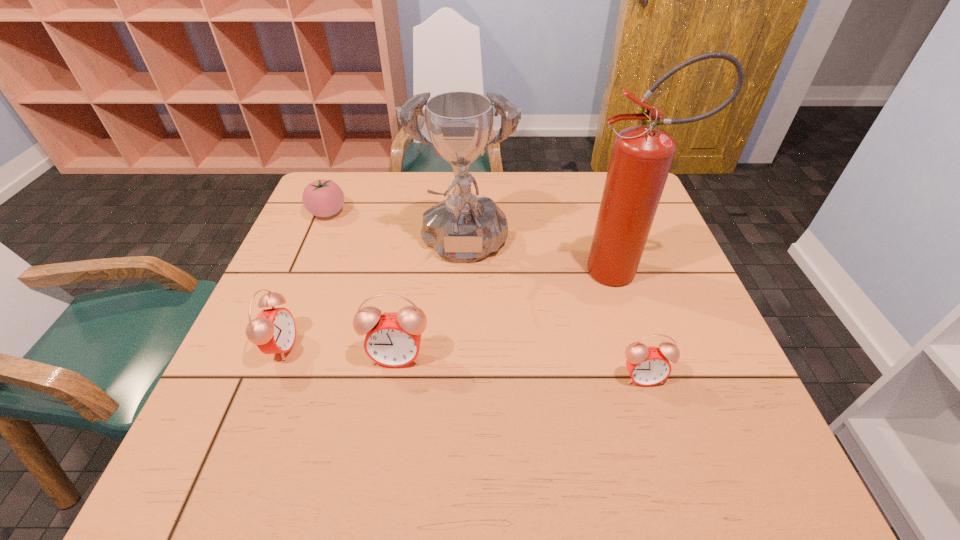
Where is `vacant position for inserting another alarm_clock evenly`? vacant position for inserting another alarm_clock evenly is located at coordinates (517, 366).